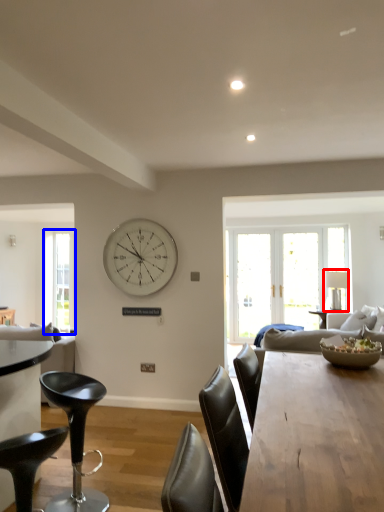
Question: Which point is closer to the camera, lamp (highlighted by a red box) or window (highlighted by a blue box)?

Choices:
 (A) lamp
 (B) window

Answer: (A)